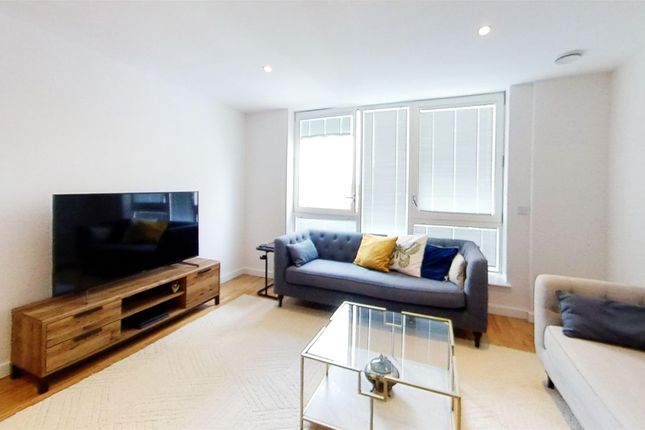
Locate an element on the screen. This screenshot has height=430, width=645. blinds is located at coordinates (320, 128), (388, 141), (452, 155), (491, 242).